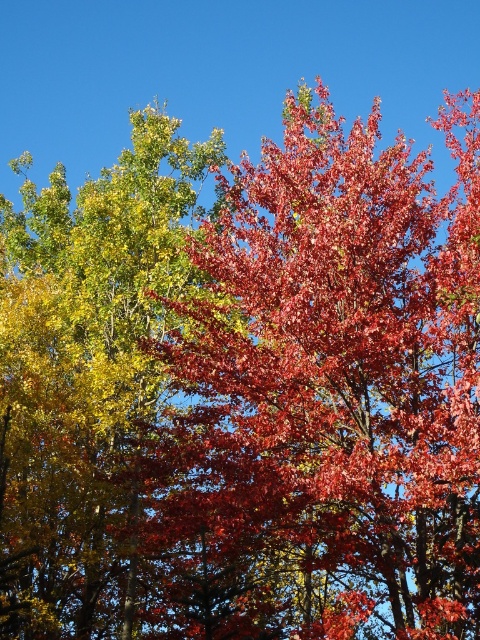
Question: In this image, where is shiny red leaves at center located relative to shiny green leaves at upper left?

Choices:
 (A) above
 (B) below

Answer: (B)

Question: Where is shiny red leaves at center located in relation to shiny green leaves at upper left in the image?

Choices:
 (A) above
 (B) below

Answer: (B)

Question: Does shiny red leaves at center appear under shiny green leaves at upper left?

Choices:
 (A) yes
 (B) no

Answer: (A)

Question: Which of the following is the farthest from the observer?

Choices:
 (A) (208, 525)
 (B) (26, 301)

Answer: (B)